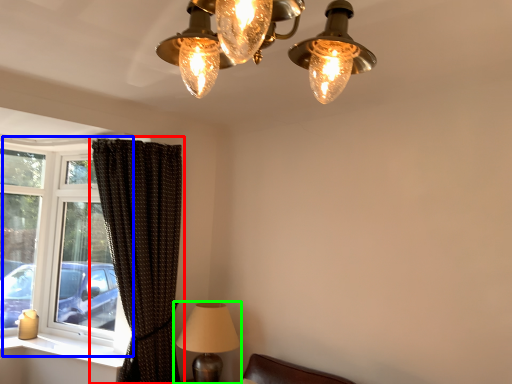
Question: Estimate the real-world distances between objects in this image. Which object is farther from curtain (highlighted by a red box), window (highlighted by a blue box) or lamp (highlighted by a green box)?

Choices:
 (A) window
 (B) lamp

Answer: (A)